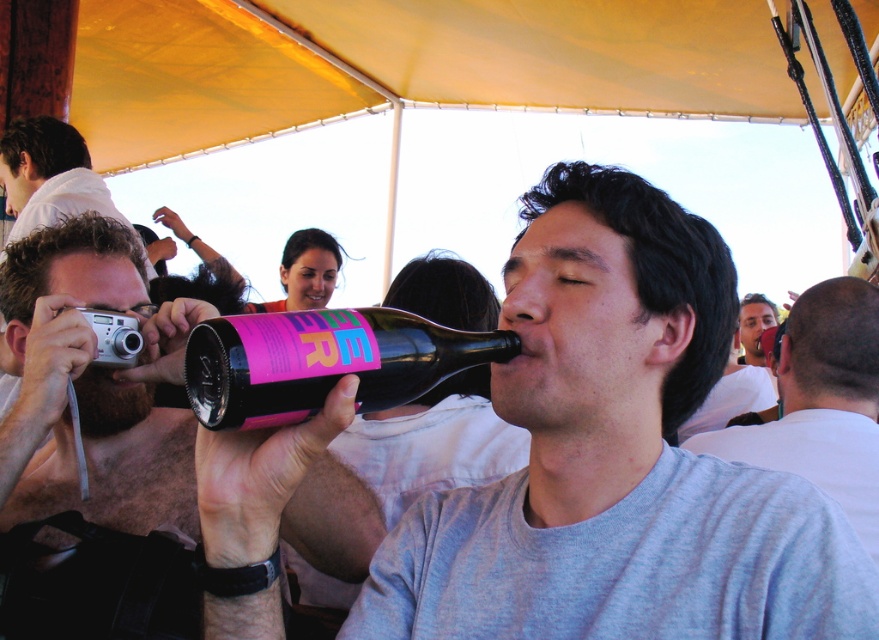
You are a photographer at the event and need to capture a clear shot of the matte black bottle at center and the smooth white shirt at center. Since the camera can only focus on one object at a time, which object should you prioritize focusing on to ensure it appears taller in the photo?

The matte black bottle at center has a greater height compared to the smooth white shirt at center, so you should prioritize focusing on the matte black bottle at center to ensure it appears taller in the photo.

You are a photographer at the event. You want to capture a clear shot of the smooth white shirt at center without the matte black bottle at center blocking it. How should you adjust your camera position?

Move the camera to the side so that the matte black bottle at center is no longer in front of the smooth white shirt at center. Since the matte black bottle at center is currently in front of the smooth white shirt at center, moving sideways will allow you to see the shirt without obstruction.